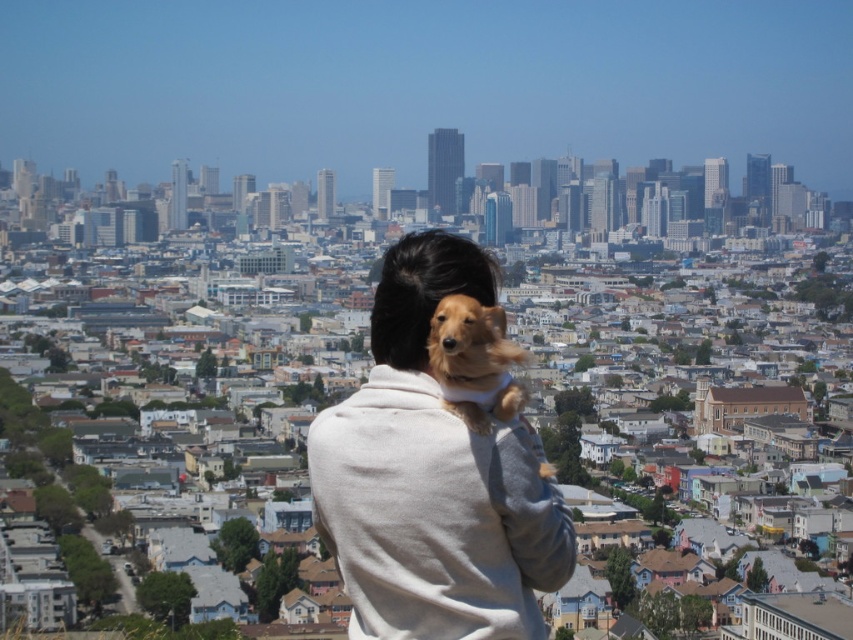
Is light beige sweater at center wider than golden fur dog at upper center?

Yes, light beige sweater at center is wider than golden fur dog at upper center.

Is light beige sweater at center bigger than golden fur dog at upper center?

Yes.

The height and width of the screenshot is (640, 853). Identify the location of light beige sweater at center. (432, 477).